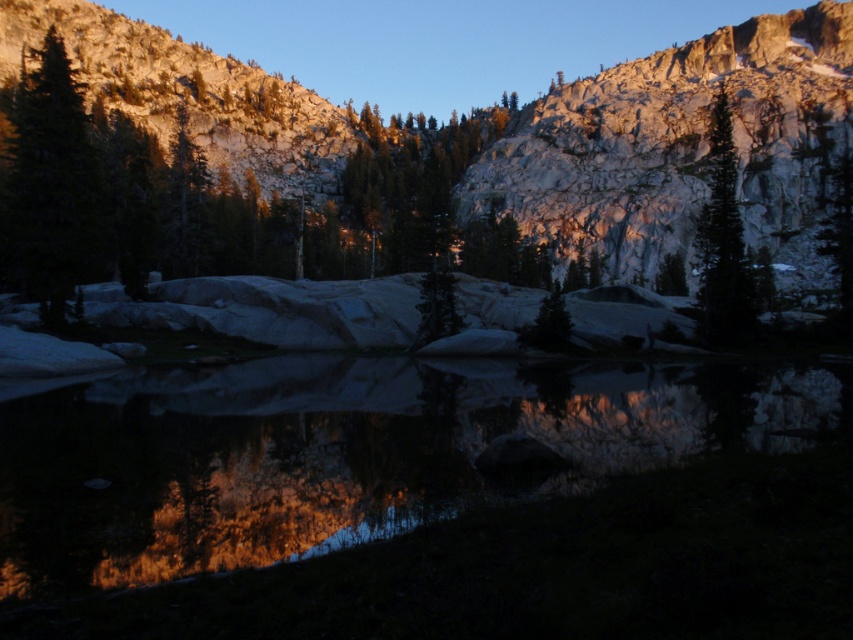
You are a hiker who wants to cross the transparent water at center to reach a viewpoint behind it. The green matte tree at left is blocking your path. Can you walk around the tree to get to the water?

The transparent water at center is shorter than the green matte tree at left, so you can walk around the tree since it is taller and does not block the entire path.

You are a hiker trying to determine which tree to rest under. You see the green matte tree at left and the green matte tree at upper right. Which tree has a larger width?

The green matte tree at left might be wider than the green matte tree at upper right according to the description.